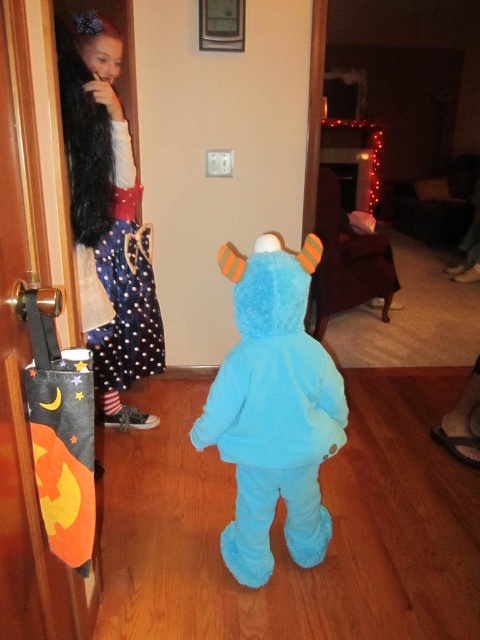
Consider the image. You are a photographer trying to capture both the fuzzy blue costume at center and the polka dot fabric dress at upper left in the same frame. Based on their positions, which object should you adjust your camera to focus on first to ensure both are in the shot?

The fuzzy blue costume at center is to the right of the polka dot fabric dress at upper left. To capture both in the same frame, focus on the polka dot fabric dress at upper left first since it is on the left side, allowing the camera to include the fuzzy blue costume at center to its right.

You are a parent trying to take a photo of your kids during Halloween. You want to make sure both the fuzzy blue costume at center and the polka dot fabric dress at upper left are in the frame. Given that your camera has a 30 inch focal length, will both kids be captured in the photo?

The fuzzy blue costume at center and the polka dot fabric dress at upper left are 31.64 inches apart from each other. Since the camera has a 30 inch focal length, the distance between them exceeds the focal length, so both kids might not fit in the frame.

You are standing at the point with coordinates point (72, 120) and want to walk to the door leading outside. There is an obstacle at point (233, 452). Can you walk straight ahead without going around the obstacle?

Point (233, 452) is in front of point (72, 120), so walking straight ahead would lead you directly to the obstacle at point (233, 452). You will need to go around it to reach the door.